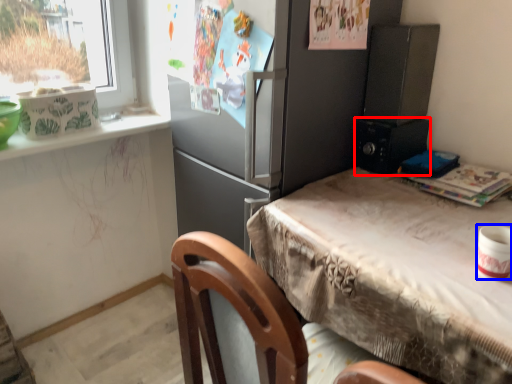
Question: Which of the following is the closest to the observer, appliance (highlighted by a red box) or appliance (highlighted by a blue box)?

Choices:
 (A) appliance
 (B) appliance

Answer: (B)